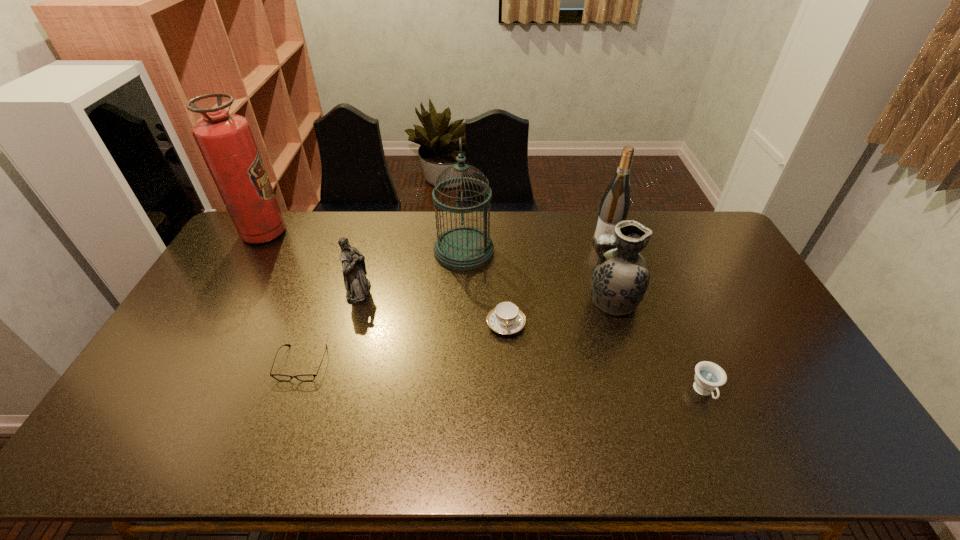
The width and height of the screenshot is (960, 540). I want to click on the leftmost object, so click(x=226, y=142).

This screenshot has width=960, height=540. Find the location of `birdcage`. birdcage is located at coordinates (464, 248).

Where is `the sixth shortest object`? This screenshot has height=540, width=960. the sixth shortest object is located at coordinates (615, 203).

Where is `the fourth tallest object`? Image resolution: width=960 pixels, height=540 pixels. the fourth tallest object is located at coordinates (620, 277).

Identify the location of figurine. (357, 286).

Find the location of a particular element. The image size is (960, 540). the right teacup is located at coordinates (709, 376).

Where is `the rightmost object`? the rightmost object is located at coordinates (709, 376).

Locate an element on the screen. The width and height of the screenshot is (960, 540). the farther teacup is located at coordinates (506, 318).

The width and height of the screenshot is (960, 540). I want to click on the shortest object, so point(307,377).

Locate an element on the screen. free spot located on the label side of the leftmost object is located at coordinates (373, 233).